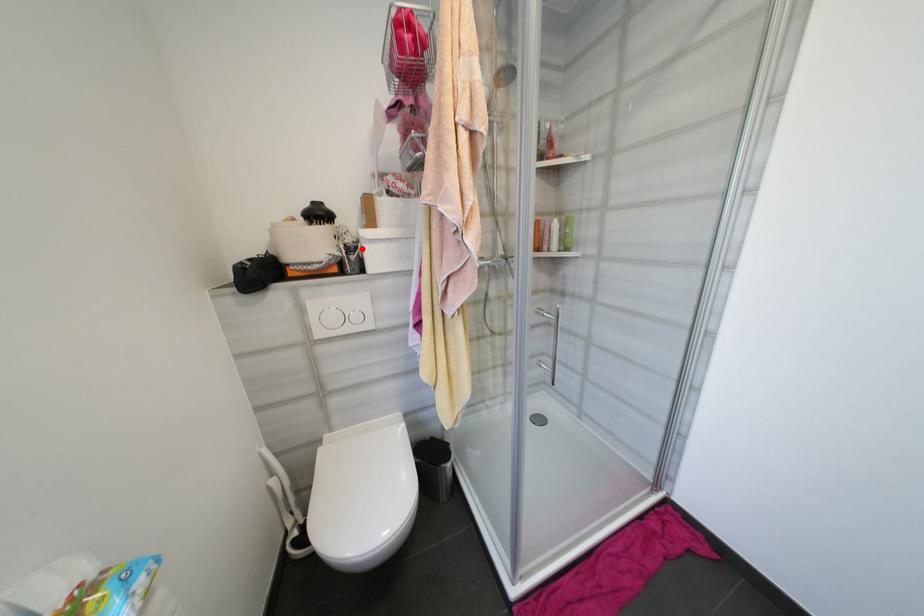
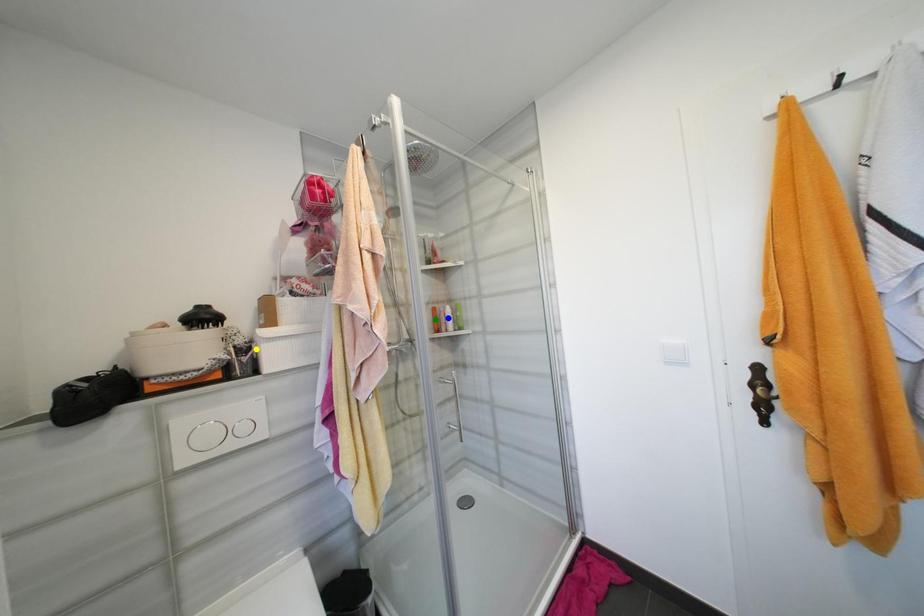
Question: I am providing you with two images of the same scene from different viewpoints. A red point is marked on the first image. You are given multiple points on the second image. Can you choose the point in image 2 that corresponds to the point in image 1?

Choices:
 (A) yellow point
 (B) blue point
 (C) green point

Answer: (A)